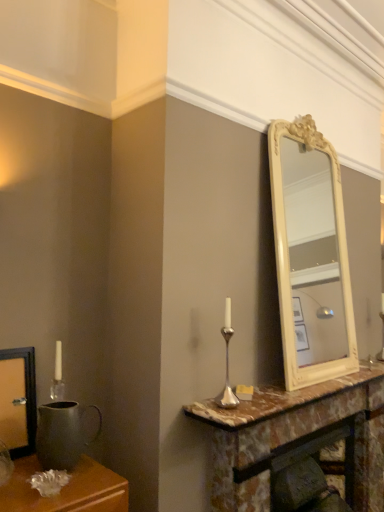
Question: In the image, is matte metal pitcher at left positioned in front of or behind silver metallic candle holder at center?

Choices:
 (A) front
 (B) behind

Answer: (A)

Question: From the image's perspective, relative to silver metallic candle holder at center, is matte metal pitcher at left above or below?

Choices:
 (A) above
 (B) below

Answer: (B)

Question: Considering the real-world distances, which object is farthest from the marble fireplace at center?

Choices:
 (A) silver metallic candle holder at center
 (B) matte metal pitcher at left
 (C) marble at center

Answer: (B)

Question: Estimate the real-world distances between objects in this image. Which object is farther from the silver metallic candle holder at center?

Choices:
 (A) matte metal pitcher at left
 (B) marble at center
 (C) marble fireplace at center

Answer: (A)